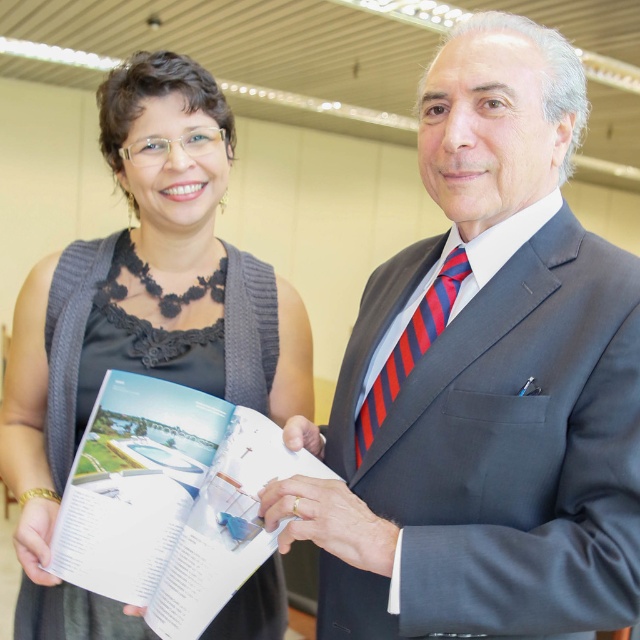
Question: Which of the following is the farthest from the observer?

Choices:
 (A) red striped tie at center
 (B) black knitted sweater at left
 (C) white paper book at center
 (D) matte gray suit at center

Answer: (B)

Question: Which object is closer to the camera taking this photo?

Choices:
 (A) red striped tie at center
 (B) black knitted sweater at left

Answer: (A)

Question: Based on their relative distances, which object is farther from the red striped tie at center?

Choices:
 (A) matte gray suit at center
 (B) black knitted sweater at left
 (C) white paper book at center

Answer: (B)

Question: Is the position of black knitted sweater at left more distant than that of white paper book at center?

Choices:
 (A) no
 (B) yes

Answer: (B)

Question: Can you confirm if matte gray suit at center is positioned above white paper book at center?

Choices:
 (A) no
 (B) yes

Answer: (B)

Question: Considering the relative positions of matte gray suit at center and white paper book at center in the image provided, where is matte gray suit at center located with respect to white paper book at center?

Choices:
 (A) left
 (B) right

Answer: (B)